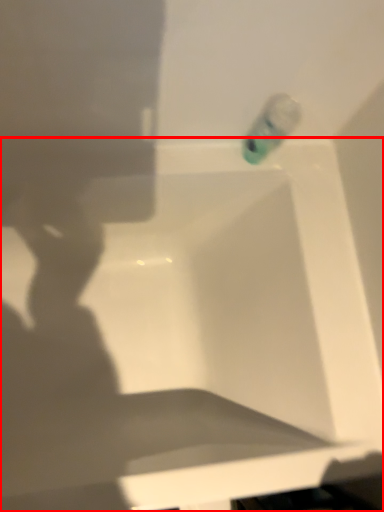
Question: Considering the relative positions of bathtub (annotated by the red box) and liquid in the image provided, where is bathtub (annotated by the red box) located with respect to the staircase?

Choices:
 (A) left
 (B) right

Answer: (A)